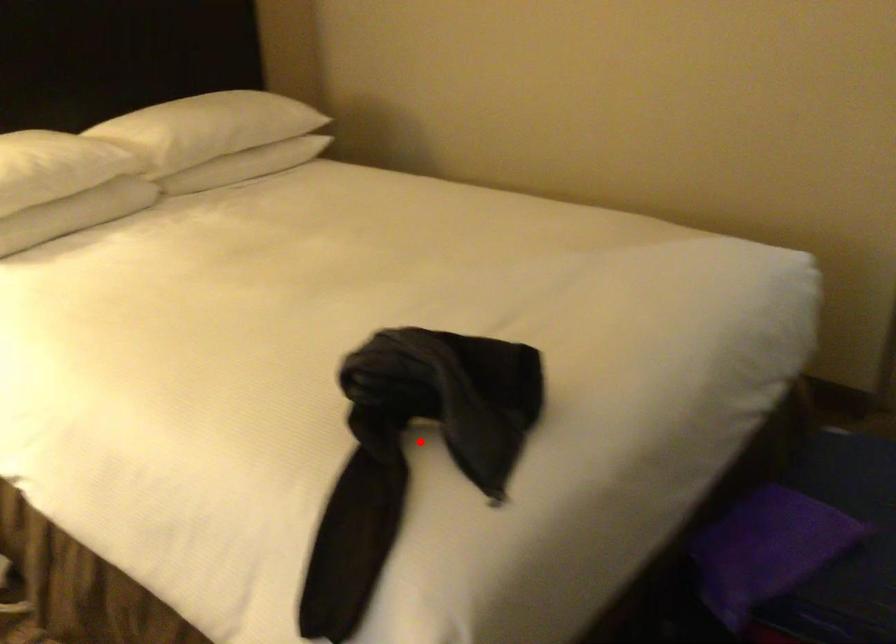
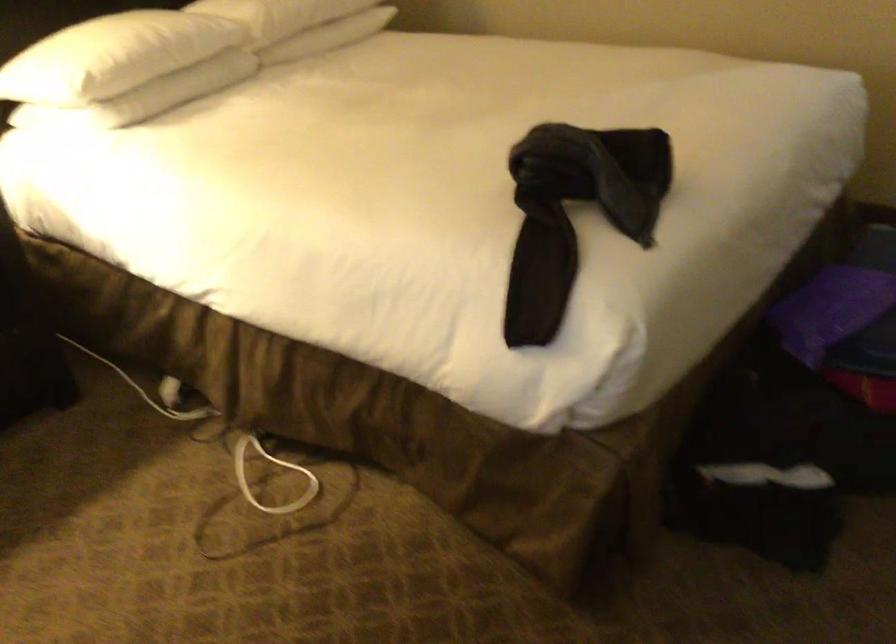
Question: A red point is marked in image1. In image2, is the corresponding 3D point closer to the camera or farther? Reply with the corresponding letter.

Choices:
 (A) The corresponding 3D point is closer.
 (B) The corresponding 3D point is farther.

Answer: (B)